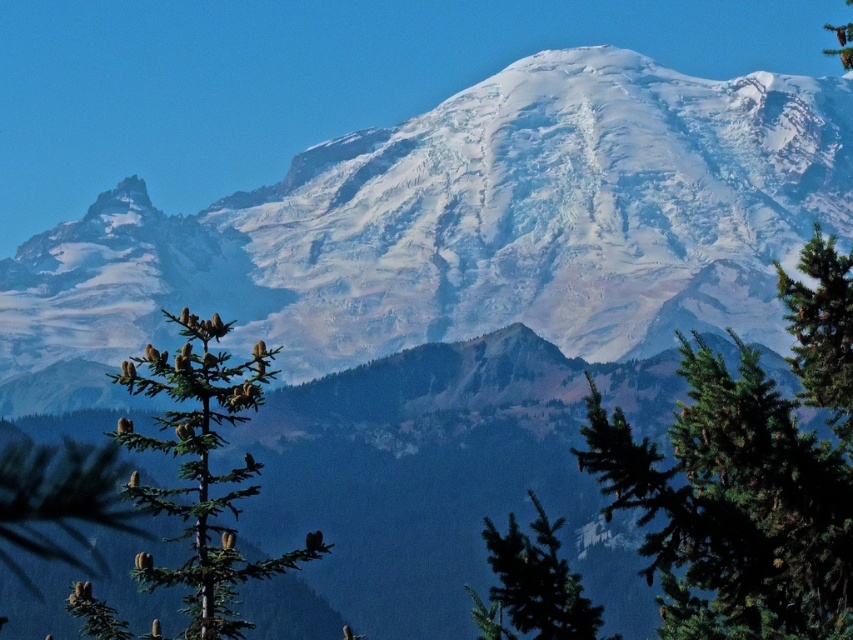
Question: Which point is closer to the camera?

Choices:
 (A) green matte tree at lower center
 (B) snowy rock mountain at center
 (C) green needle-like at center
 (D) green needle-like tree at upper right

Answer: (C)

Question: Does snowy rock mountain at center have a greater width compared to green needle-like at right?

Choices:
 (A) no
 (B) yes

Answer: (B)

Question: Which of the following is the farthest from the observer?

Choices:
 (A) green needle-like tree at center-left
 (B) green matte tree at lower center
 (C) green needle-like at center

Answer: (A)

Question: Is green needle-like at center to the right of green needle-like tree at center-left from the viewer's perspective?

Choices:
 (A) yes
 (B) no

Answer: (A)

Question: Is snowy rock mountain at center smaller than green matte tree at lower center?

Choices:
 (A) yes
 (B) no

Answer: (B)

Question: Based on their relative distances, which object is nearer to the green needle-like tree at center-left?

Choices:
 (A) green needle-like at center
 (B) green matte tree at lower center

Answer: (B)